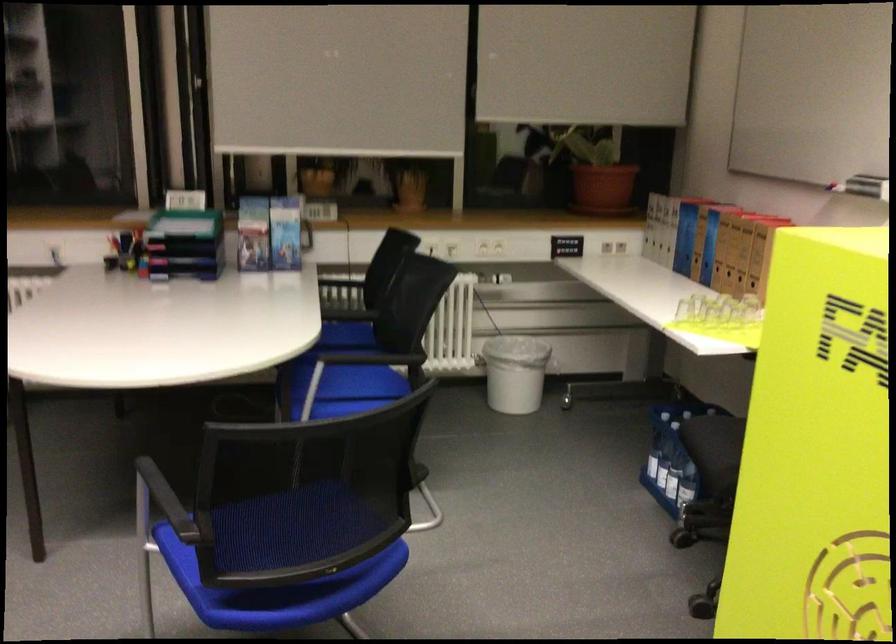
Where would you pull the green organizer tray? Please return your answer as a coordinate pair (x, y).

(694, 468)